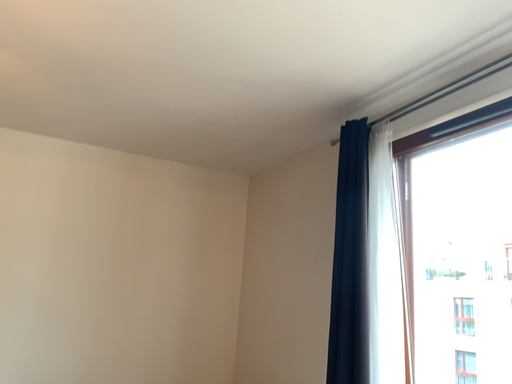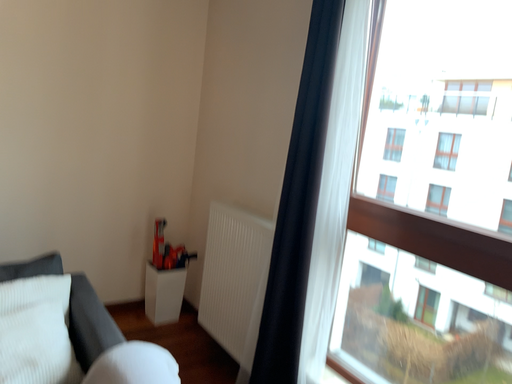
Question: How did the camera likely rotate when shooting the video?

Choices:
 (A) rotated left
 (B) rotated right

Answer: (B)